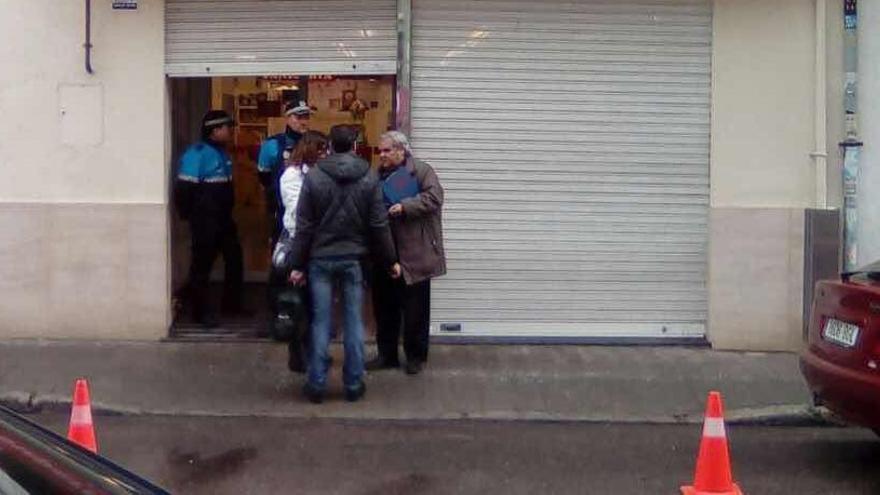
At what (x,y) coordinates should I click in order to perform the action: click on binder. Please return your answer as a coordinate pair (x, y). Looking at the image, I should click on (394, 185).